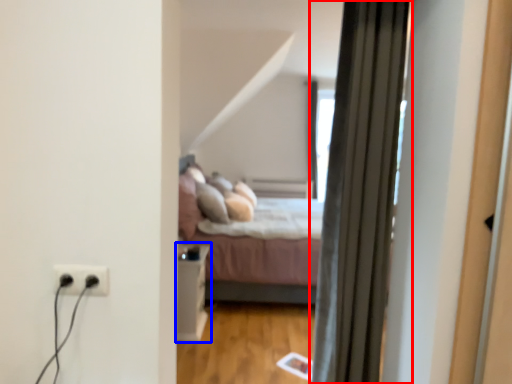
Question: Among these objects, which one is farthest to the camera, curtain (highlighted by a red box) or table (highlighted by a blue box)?

Choices:
 (A) curtain
 (B) table

Answer: (B)